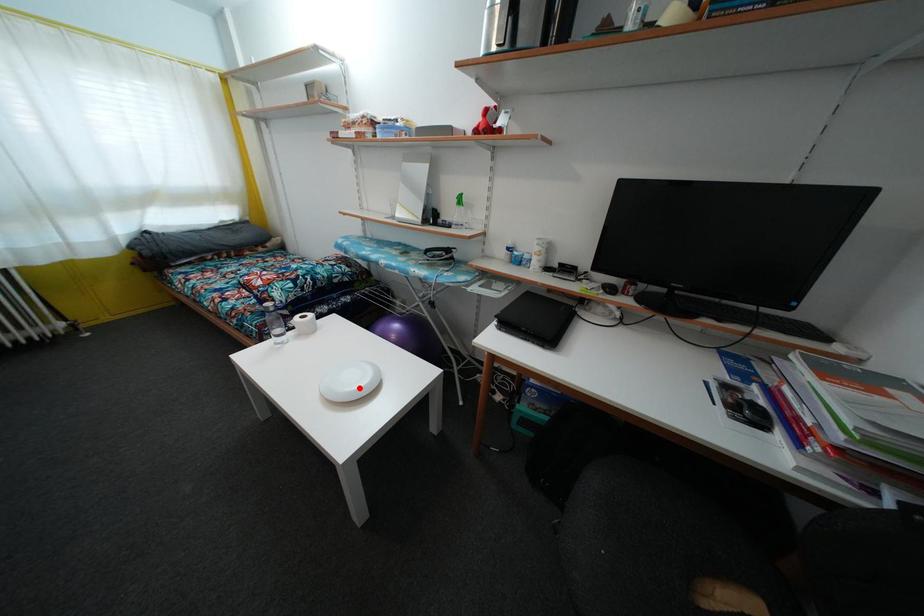
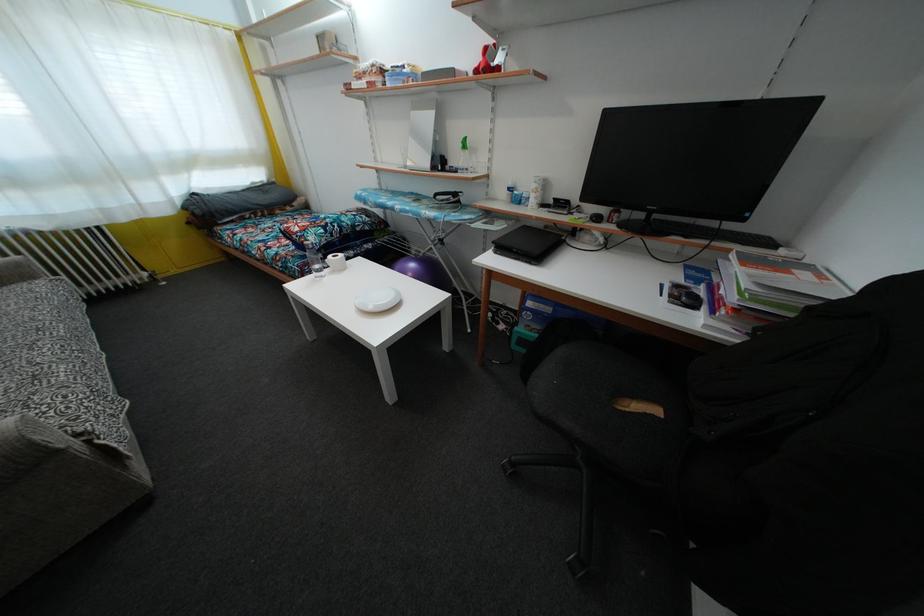
Find the pixel in the second image that matches the highlighted location in the first image.

(385, 306)